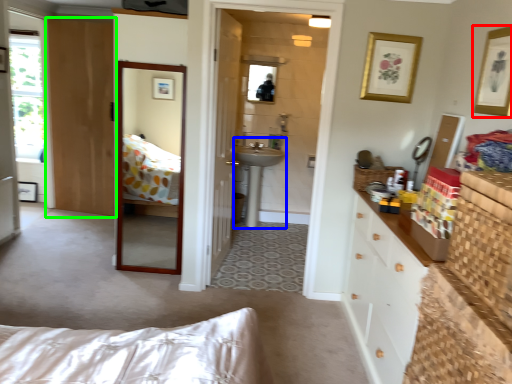
Question: Which is farther away from picture frame (highlighted by a red box)? sink (highlighted by a blue box) or door (highlighted by a green box)?

Choices:
 (A) sink
 (B) door

Answer: (B)